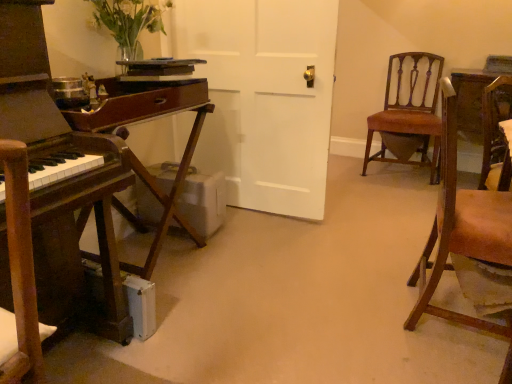
Image resolution: width=512 pixels, height=384 pixels. What do you see at coordinates (128, 22) in the screenshot? I see `translucent glass vase at upper left` at bounding box center [128, 22].

What is the approximate height of translucent glass vase at upper left?

translucent glass vase at upper left is 10.41 inches in height.

In order to click on brown wood table at left in this screenshot , I will do `click(150, 119)`.

What do you see at coordinates (150, 119) in the screenshot?
I see `brown wood table at left` at bounding box center [150, 119].

This screenshot has height=384, width=512. Identify the location of brown leather chair at right, acting as the first chair starting from the back. (409, 114).

Find the location of `brown leather chair at right, arranged as the second chair when viewed from the back`. brown leather chair at right, arranged as the second chair when viewed from the back is located at coordinates click(463, 234).

Find the location of a particular element. Image resolution: width=512 pixels, height=384 pixels. translucent glass vase at upper left is located at coordinates (128, 22).

From the image's perspective, is brown wooden desk at left on top of brown leather chair at right, the second chair from the front?

Incorrect, from the image's perspective, brown wooden desk at left is lower than brown leather chair at right, the second chair from the front.

Can you confirm if brown wooden desk at left is taller than brown leather chair at right, the second chair from the front?

Yes, brown wooden desk at left is taller than brown leather chair at right, the second chair from the front.

Who is smaller, brown wooden desk at left or brown leather chair at right, acting as the first chair starting from the back?

Smaller between the two is brown wooden desk at left.

From a real-world perspective, is brown wooden desk at left positioned above or below brown leather chair at right, the second chair from the front?

brown wooden desk at left is situated higher than brown leather chair at right, the second chair from the front, in the real world.

Who is taller, brown wooden desk at left or brown wood table at left?

Standing taller between the two is brown wooden desk at left.

Consider the image. Is brown wood table at left completely or partially inside brown wooden desk at left?

No.

Locate an element on the screen. table that is behind the brown wooden desk at left is located at coordinates (150, 119).

Considering the points (29, 352) and (204, 78), which point is in front, point (29, 352) or point (204, 78)?

Point (29, 352)

What are the coordinates of `desk above the brown leather chair at right, arranged as the second chair when viewed from the back (from the image's perspective)` in the screenshot? It's located at (49, 200).

Who is bigger, brown wooden desk at left or brown leather chair at right, positioned as the 1th chair in front-to-back order?

brown leather chair at right, positioned as the 1th chair in front-to-back order.

Would you say brown wooden desk at left is inside or outside brown leather chair at right, positioned as the 1th chair in front-to-back order?

brown wooden desk at left cannot be found inside brown leather chair at right, positioned as the 1th chair in front-to-back order.

Is brown wooden desk at left positioned with its back to brown leather chair at right, arranged as the second chair when viewed from the back?

No.

Does translucent glass vase at upper left appear on the left side of brown leather chair at right, the second chair from the front?

Yes, translucent glass vase at upper left is to the left of brown leather chair at right, the second chair from the front.

Considering the sizes of translucent glass vase at upper left and brown leather chair at right, acting as the first chair starting from the back, in the image, is translucent glass vase at upper left taller or shorter than brown leather chair at right, acting as the first chair starting from the back,?

In the image, translucent glass vase at upper left appears to be shorter than brown leather chair at right, acting as the first chair starting from the back.

Is translucent glass vase at upper left further to camera compared to brown leather chair at right, acting as the first chair starting from the back?

No, it is in front of brown leather chair at right, acting as the first chair starting from the back.

Based on the photo, which of these two, translucent glass vase at upper left or brown leather chair at right, acting as the first chair starting from the back, is thinner?

translucent glass vase at upper left is thinner.

Are brown leather chair at right, the second chair from the front, and brown leather chair at right, arranged as the second chair when viewed from the back, located far from each other?

Yes, brown leather chair at right, the second chair from the front, and brown leather chair at right, arranged as the second chair when viewed from the back, are quite far apart.

Between brown leather chair at right, the second chair from the front, and brown leather chair at right, arranged as the second chair when viewed from the back, which one has larger size?

With larger size is brown leather chair at right, the second chair from the front.

Based on the photo, is brown leather chair at right, the second chair from the front, looking in the opposite direction of brown leather chair at right, positioned as the 1th chair in front-to-back order?

No, brown leather chair at right, the second chair from the front, is not facing away from brown leather chair at right, positioned as the 1th chair in front-to-back order.

From the image's perspective, is brown leather chair at right, positioned as the 1th chair in front-to-back order, located above or below brown wooden desk at left?

brown leather chair at right, positioned as the 1th chair in front-to-back order, is situated lower than brown wooden desk at left in the image.

From a real-world perspective, which object stands above the other?

In real-world perspective, brown wooden desk at left is above.

How distant is brown leather chair at right, arranged as the second chair when viewed from the back, from brown wooden desk at left?

They are 1.17 meters apart.

Is brown leather chair at right, arranged as the second chair when viewed from the back, positioned in front of brown wooden desk at left?

No, it is not.

Is brown leather chair at right, positioned as the 1th chair in front-to-back order, facing away from translucent glass vase at upper left?

Absolutely, brown leather chair at right, positioned as the 1th chair in front-to-back order, is directed away from translucent glass vase at upper left.

Consider the image. From the image's perspective, is brown leather chair at right, positioned as the 1th chair in front-to-back order, beneath translucent glass vase at upper left?

Yes, from the image's perspective, brown leather chair at right, positioned as the 1th chair in front-to-back order, is beneath translucent glass vase at upper left.

Considering the relative sizes of brown leather chair at right, positioned as the 1th chair in front-to-back order, and translucent glass vase at upper left in the image provided, is brown leather chair at right, positioned as the 1th chair in front-to-back order, taller than translucent glass vase at upper left?

Yes.

Identify the location of chair above the brown wooden desk at left (from the image's perspective). Image resolution: width=512 pixels, height=384 pixels. (409, 114).

Identify the location of desk in front of the brown wood table at left. (49, 200).

Looking at the image, which one is located closer to brown leather chair at right, positioned as the 1th chair in front-to-back order, brown wood table at left or translucent glass vase at upper left?

The object closer to brown leather chair at right, positioned as the 1th chair in front-to-back order, is brown wood table at left.

When comparing their distances from brown wooden desk at left, does brown leather chair at right, positioned as the 1th chair in front-to-back order, or translucent glass vase at upper left seem closer?

Among the two, translucent glass vase at upper left is located nearer to brown wooden desk at left.

Based on their spatial positions, is brown leather chair at right, positioned as the 1th chair in front-to-back order, or brown wooden desk at left further from brown leather chair at right, acting as the first chair starting from the back?

brown wooden desk at left is further to brown leather chair at right, acting as the first chair starting from the back.

Considering their positions, is brown leather chair at right, acting as the first chair starting from the back, positioned further to brown wooden desk at left than translucent glass vase at upper left?

brown leather chair at right, acting as the first chair starting from the back, lies further to brown wooden desk at left than the other object.

From the image, which object appears to be farther from brown wood table at left, brown wooden desk at left or brown leather chair at right, acting as the first chair starting from the back?

Among the two, brown leather chair at right, acting as the first chair starting from the back, is located further to brown wood table at left.

When comparing their distances from brown leather chair at right, acting as the first chair starting from the back, does brown wooden desk at left or translucent glass vase at upper left seem closer?

translucent glass vase at upper left.

Based on their spatial positions, is brown wood table at left or translucent glass vase at upper left closer to brown wooden desk at left?

The object closer to brown wooden desk at left is brown wood table at left.

Based on their spatial positions, is brown wooden desk at left or brown leather chair at right, arranged as the second chair when viewed from the back, closer to brown wood table at left?

brown wooden desk at left lies closer to brown wood table at left than the other object.

Locate an element on the screen. The image size is (512, 384). floral arrangement between brown wood table at left and brown leather chair at right, acting as the first chair starting from the back is located at coordinates (128, 22).

The image size is (512, 384). What are the coordinates of `table located between brown leather chair at right, arranged as the second chair when viewed from the back, and brown leather chair at right, the second chair from the front, in the depth direction` in the screenshot? It's located at (150, 119).

Locate an element on the screen. This screenshot has width=512, height=384. floral arrangement located between brown wooden desk at left and brown leather chair at right, the second chair from the front, in the depth direction is located at coordinates (128, 22).

Locate an element on the screen. table between brown wooden desk at left and brown leather chair at right, acting as the first chair starting from the back, in the front-back direction is located at coordinates (150, 119).